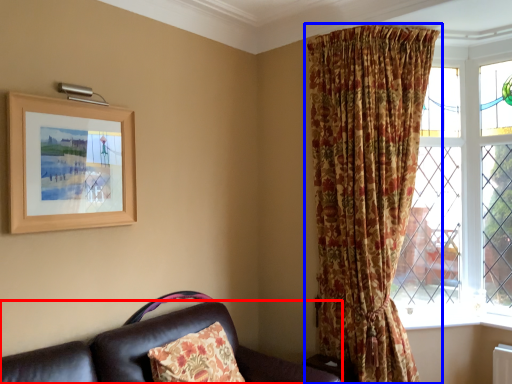
Question: Among these objects, which one is nearest to the camera, studio couch (highlighted by a red box) or curtain (highlighted by a blue box)?

Choices:
 (A) studio couch
 (B) curtain

Answer: (A)